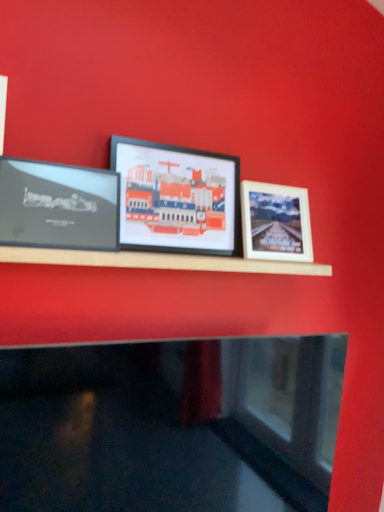
Question: Is matte black picture frame at center, the second picture frame in the right-to-left sequence, completely or partially inside white matte picture frame at right, the 3th picture frame viewed from the left?

Choices:
 (A) no
 (B) yes

Answer: (A)

Question: Are white matte picture frame at right, which ranks as the 1th picture frame in right-to-left order, and matte black picture frame at center, marked as the 2th picture frame in a left-to-right arrangement, far apart?

Choices:
 (A) yes
 (B) no

Answer: (B)

Question: Is the depth of white matte picture frame at right, which ranks as the 1th picture frame in right-to-left order, greater than that of matte black picture frame at center, the second picture frame in the right-to-left sequence?

Choices:
 (A) yes
 (B) no

Answer: (A)

Question: Can you confirm if white matte picture frame at right, the 3th picture frame viewed from the left, is taller than matte black picture frame at center, marked as the 2th picture frame in a left-to-right arrangement?

Choices:
 (A) no
 (B) yes

Answer: (A)

Question: Is white matte picture frame at right, which ranks as the 1th picture frame in right-to-left order, smaller than matte black picture frame at center, the second picture frame in the right-to-left sequence?

Choices:
 (A) no
 (B) yes

Answer: (B)

Question: Choose the correct answer: Is matte black picture frame at center, marked as the 2th picture frame in a left-to-right arrangement, inside white matte picture frame at right, the 3th picture frame viewed from the left, or outside it?

Choices:
 (A) outside
 (B) inside

Answer: (A)

Question: From the image's perspective, is matte black picture frame at center, marked as the 2th picture frame in a left-to-right arrangement, above or below white matte picture frame at right, the 3th picture frame viewed from the left?

Choices:
 (A) above
 (B) below

Answer: (A)

Question: Is matte black picture frame at center, marked as the 2th picture frame in a left-to-right arrangement, wider or thinner than white matte picture frame at right, which ranks as the 1th picture frame in right-to-left order?

Choices:
 (A) wide
 (B) thin

Answer: (B)

Question: In the image, is matte black picture frame at center, marked as the 2th picture frame in a left-to-right arrangement, on the left side or the right side of white matte picture frame at right, the 3th picture frame viewed from the left?

Choices:
 (A) right
 (B) left

Answer: (B)

Question: From the image's perspective, relative to white matte picture frame at right, which ranks as the 1th picture frame in right-to-left order, is matte black frame at left, the third picture frame in the right-to-left sequence, above or below?

Choices:
 (A) above
 (B) below

Answer: (A)

Question: From a real-world perspective, is matte black frame at left, the third picture frame in the right-to-left sequence, positioned above or below white matte picture frame at right, the 3th picture frame viewed from the left?

Choices:
 (A) above
 (B) below

Answer: (B)

Question: Based on their positions, is matte black frame at left, the third picture frame in the right-to-left sequence, located to the left or right of white matte picture frame at right, the 3th picture frame viewed from the left?

Choices:
 (A) right
 (B) left

Answer: (B)

Question: Is matte black frame at left, the third picture frame in the right-to-left sequence, in front of or behind white matte picture frame at right, the 3th picture frame viewed from the left, in the image?

Choices:
 (A) behind
 (B) front

Answer: (B)

Question: Considering the positions of matte black frame at left, the third picture frame in the right-to-left sequence, and matte black picture frame at center, marked as the 2th picture frame in a left-to-right arrangement, in the image, is matte black frame at left, the third picture frame in the right-to-left sequence, taller or shorter than matte black picture frame at center, marked as the 2th picture frame in a left-to-right arrangement,?

Choices:
 (A) short
 (B) tall

Answer: (A)

Question: Is point (82, 176) closer or farther from the camera than point (210, 164)?

Choices:
 (A) farther
 (B) closer

Answer: (B)